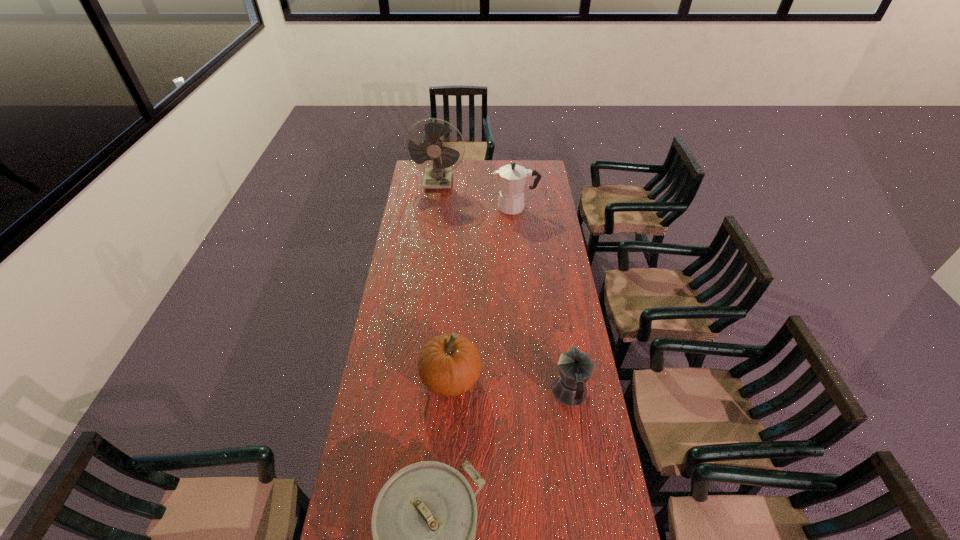
Identify the location of blank space located 0.290m on the stem of the pumpkin. (555, 379).

Where is `vacant space located 0.250m at the spout of the shorter coffeepot`? This screenshot has width=960, height=540. vacant space located 0.250m at the spout of the shorter coffeepot is located at coordinates (559, 323).

The height and width of the screenshot is (540, 960). What are the coordinates of `vacant space located 0.340m at the spout of the shorter coffeepot` in the screenshot? It's located at pyautogui.click(x=556, y=307).

Locate an element on the screen. The width and height of the screenshot is (960, 540). blank space located 0.070m at the spout of the shorter coffeepot is located at coordinates [564, 357].

Identify the location of object located in the far edge section of the desktop. (439, 175).

The image size is (960, 540). I want to click on object at the left edge, so click(439, 175).

You are a GUI agent. You are given a task and a screenshot of the screen. Output one action in this format:
    pyautogui.click(x=<x>, y=<y>)
    Task: Click on the object that is at the far left corner
    This screenshot has height=540, width=960.
    Given the screenshot: What is the action you would take?
    pyautogui.click(x=439, y=175)

Where is `vacant area at the left edge`? vacant area at the left edge is located at coordinates (370, 538).

I want to click on free space at the right edge of the desktop, so click(590, 389).

At what (x,y) coordinates should I click in order to perform the action: click on vacant area at the far left corner of the desktop. Please return your answer as a coordinate pair (x, y). Looking at the image, I should click on (417, 172).